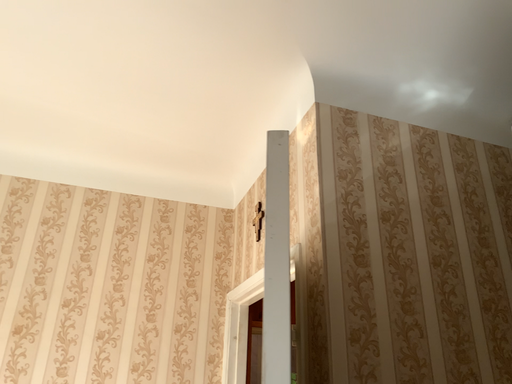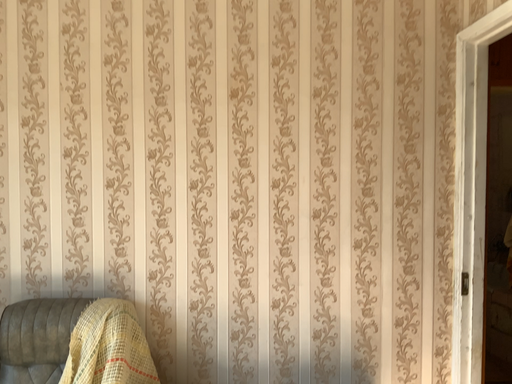
Question: Which way did the camera rotate in the video?

Choices:
 (A) rotated upward
 (B) rotated downward

Answer: (B)